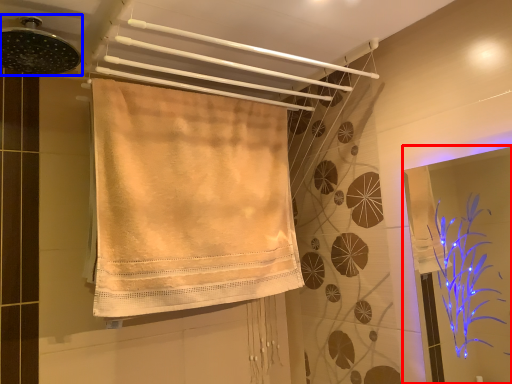
Question: Which object is further to the camera taking this photo, screen door (highlighted by a red box) or shower (highlighted by a blue box)?

Choices:
 (A) screen door
 (B) shower

Answer: (A)